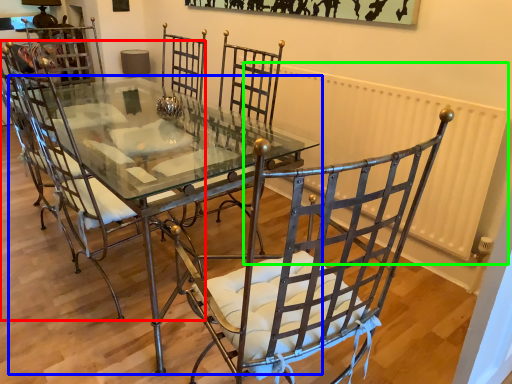
Question: Which object is the closest to the chair (highlighted by a red box)? Choose among these: table (highlighted by a blue box) or radiator (highlighted by a green box).

Choices:
 (A) table
 (B) radiator

Answer: (A)